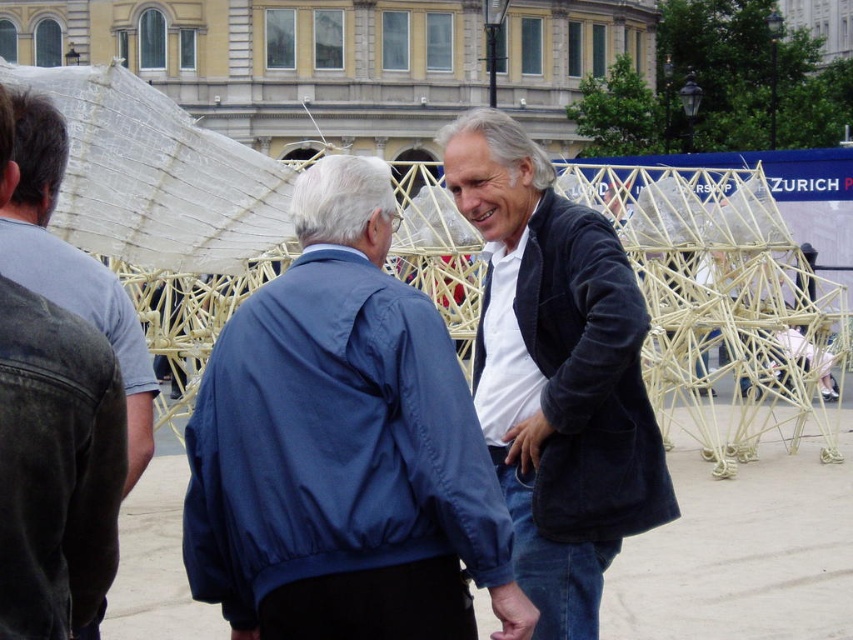
You are standing in the outdoor scene and want to reach the point marked at coordinates (264, 337). If you walk straight ahead, will you reach that point before walking 40 meters?

The point at coordinates (264, 337) is 37.68 meters from the viewer. Since 37.68 meters is less than 40 meters, you will reach the point before walking 40 meters.

You are standing in the outdoor scene and want to locate the blue fabric jacket at center and the dark blue fabric jacket at lower left. Which one is positioned more to the left?

The dark blue fabric jacket at lower left is positioned more to the left compared to the blue fabric jacket at center.

You are a photographer trying to capture a candid shot of the two men in the scene. You want to ensure that both the blue fabric jacket at center and the denim jacket at left are clearly visible in the frame. Based on their positions, which jacket should you focus on first to ensure they are both in the shot?

The blue fabric jacket at center is positioned on the right side of denim jacket at left, so you should focus on the denim jacket at left first to ensure both jackets are in the frame since it is on the left and the blue one is to its right.